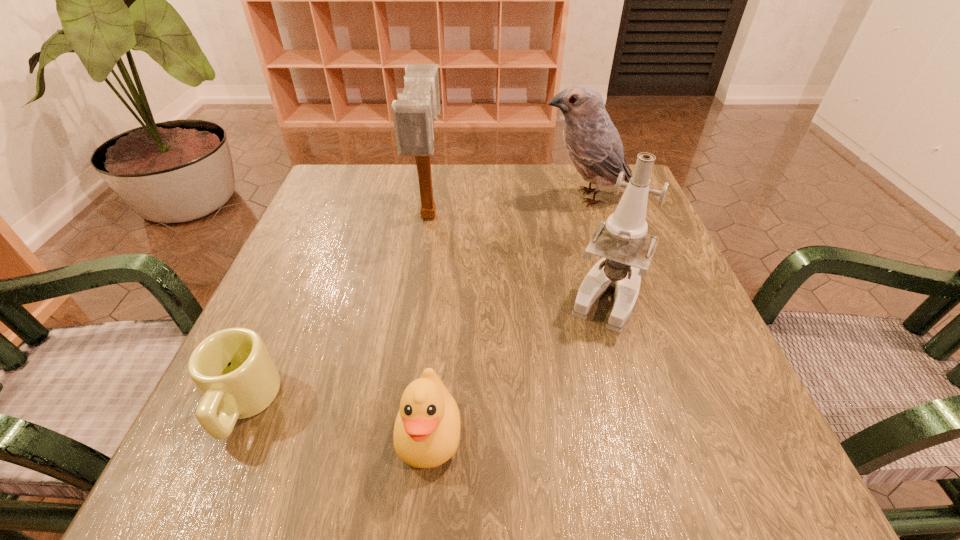
Locate an element on the screen. vacant area that lies between the fourth tallest object and the parrot is located at coordinates (x=508, y=315).

What are the coordinates of `free space between the microscope and the mug` in the screenshot? It's located at (425, 350).

Identify the location of vacant point located between the mug and the parrot. (415, 300).

The height and width of the screenshot is (540, 960). I want to click on empty space that is in between the parrot and the mallet, so click(507, 206).

Find the location of `vacant area between the parrot and the leftmost object`. vacant area between the parrot and the leftmost object is located at coordinates (415, 300).

Locate an element on the screen. object that stands as the closest to the parrot is located at coordinates (627, 250).

Select which object is the closest to the parrot. Please provide its 2D coordinates. Your answer should be formatted as a tuple, i.e. [(x, y)], where the tuple contains the x and y coordinates of a point satisfying the conditions above.

[(627, 250)]

Locate an element on the screen. The height and width of the screenshot is (540, 960). vacant space that satisfies the following two spatial constraints: 1. on the front-facing side of the parrot; 2. at the beak of the fourth tallest object is located at coordinates (660, 433).

At what (x,y) coordinates should I click in order to perform the action: click on free space that satisfies the following two spatial constraints: 1. on the front-facing side of the parrot; 2. at the beak of the second shortest object. Please return your answer as a coordinate pair (x, y). Looking at the image, I should click on (660, 433).

I want to click on free point that satisfies the following two spatial constraints: 1. on the front-facing side of the parrot; 2. on the front side of the third farthest object, so click(617, 295).